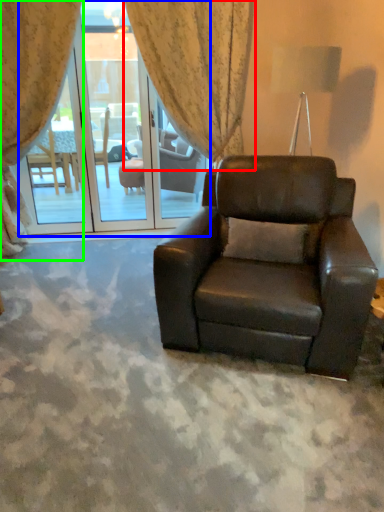
Question: Which object is the closest to the curtain (highlighted by a red box)? Choose among these: screen door (highlighted by a blue box) or curtain (highlighted by a green box).

Choices:
 (A) screen door
 (B) curtain

Answer: (B)